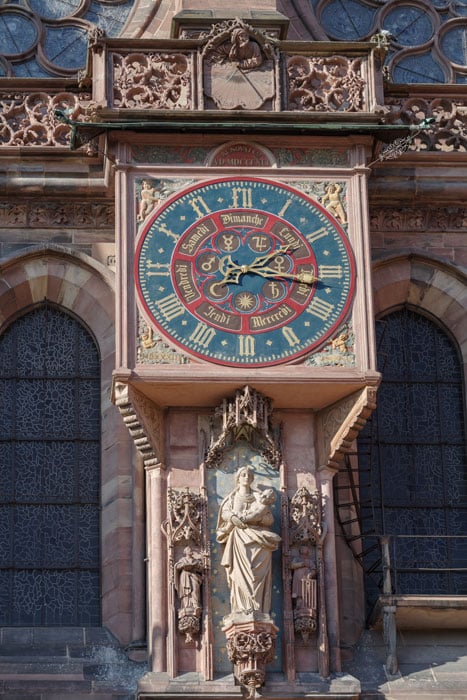
Image resolution: width=467 pixels, height=700 pixels. I want to click on hour hand of clock, so click(277, 251).